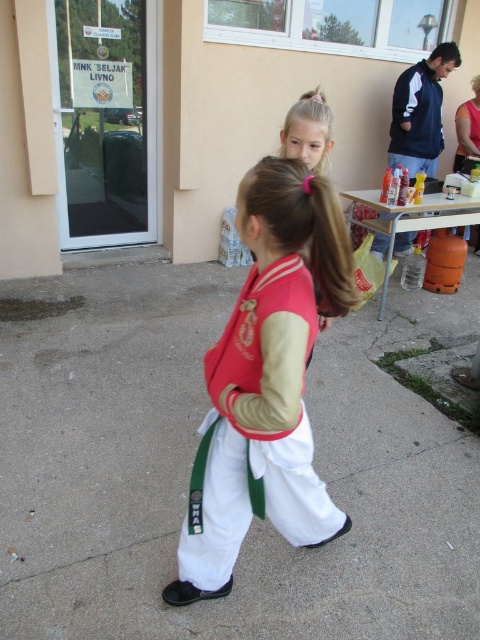
Question: Does white concrete pavement at center appear under white cotton karate uniform at center?

Choices:
 (A) yes
 (B) no

Answer: (B)

Question: Which point appears farthest from the camera in this image?

Choices:
 (A) (72, 490)
 (B) (274, 372)

Answer: (A)

Question: Which of the following is the farthest from the observer?

Choices:
 (A) (60, 605)
 (B) (262, 380)

Answer: (A)

Question: Which point is closer to the camera taking this photo?

Choices:
 (A) (268, 211)
 (B) (336, 602)

Answer: (A)

Question: Is white concrete pavement at center to the right of white cotton karate uniform at center from the viewer's perspective?

Choices:
 (A) yes
 (B) no

Answer: (A)

Question: Does white concrete pavement at center appear under white cotton karate uniform at center?

Choices:
 (A) yes
 (B) no

Answer: (B)